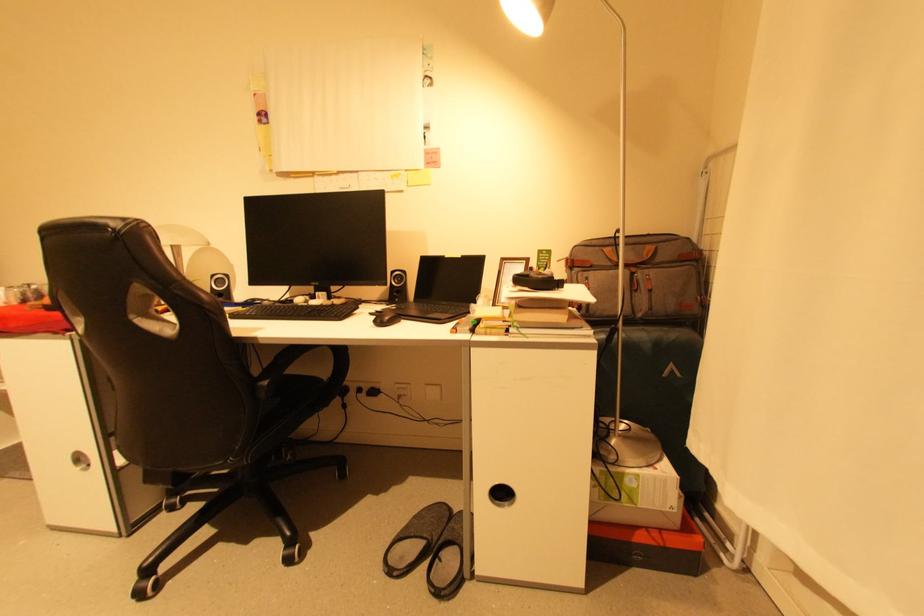
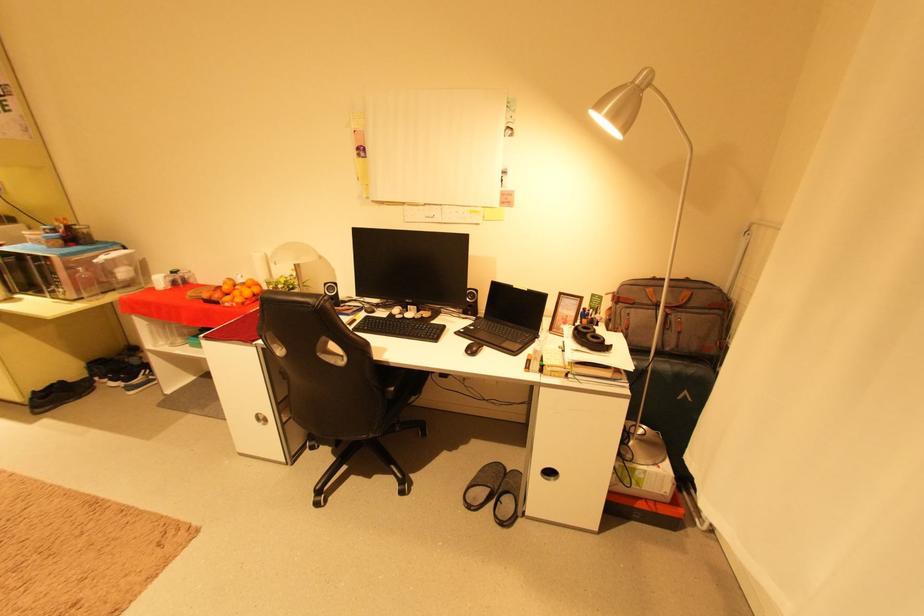
The point at (651, 246) is marked in the first image. Where is the corresponding point in the second image?

(688, 290)